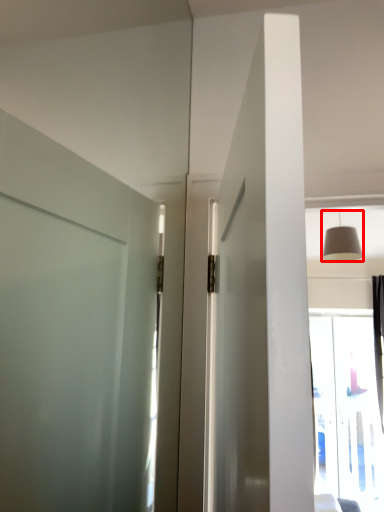
Question: Observing the image, what is the correct spatial positioning of light fixture (annotated by the red box) in reference to window?

Choices:
 (A) right
 (B) left

Answer: (B)